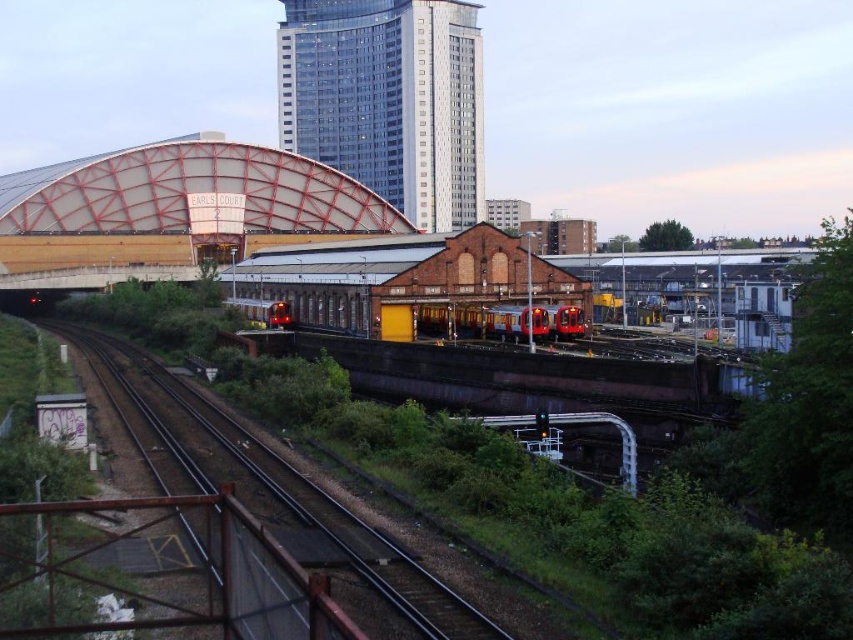
Does glassy metallic skyscraper at upper center appear over matte red train at center?

Correct, glassy metallic skyscraper at upper center is located above matte red train at center.

Does glassy metallic skyscraper at upper center have a larger size compared to matte red train at center?

Indeed, glassy metallic skyscraper at upper center has a larger size compared to matte red train at center.

At what (x,y) coordinates should I click in order to perform the action: click on glassy metallic skyscraper at upper center. Please return your answer as a coordinate pair (x, y). This screenshot has width=853, height=640. Looking at the image, I should click on (387, 99).

Is glassy metallic skyscraper at upper center bigger than red metallic train at center?

Yes, glassy metallic skyscraper at upper center is bigger than red metallic train at center.

Does glassy metallic skyscraper at upper center have a greater height compared to red metallic train at center?

Yes.

Is point (393, 140) closer to viewer compared to point (527, 312)?

That is False.

Where is `glassy metallic skyscraper at upper center`? The image size is (853, 640). glassy metallic skyscraper at upper center is located at coordinates (387, 99).

Based on the photo, who is shorter, glassy metallic skyscraper at upper center or smooth metal train track at center?

smooth metal train track at center

Is glassy metallic skyscraper at upper center smaller than smooth metal train track at center?

Actually, glassy metallic skyscraper at upper center might be larger than smooth metal train track at center.

Is point (352, 96) farther from viewer compared to point (497, 636)?

Yes, it is.

I want to click on glassy metallic skyscraper at upper center, so click(387, 99).